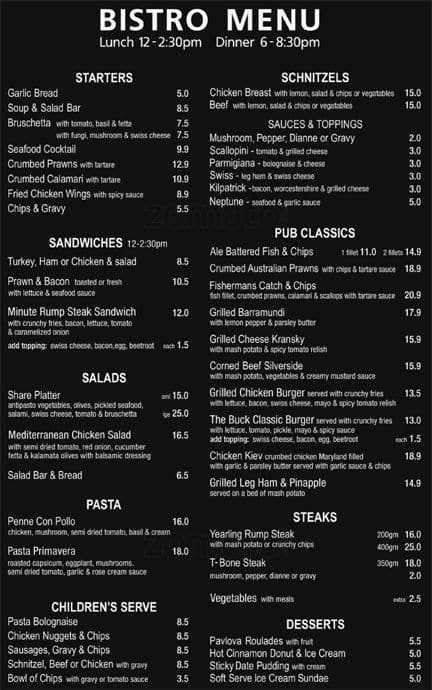
Find the location of `children's items`. children's items is located at coordinates (50, 621), (53, 633), (64, 653), (65, 662), (69, 680).